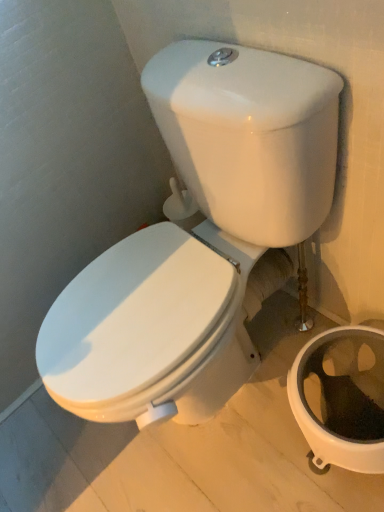
Image resolution: width=384 pixels, height=512 pixels. What do you see at coordinates (200, 239) in the screenshot?
I see `white glossy toilet at center` at bounding box center [200, 239].

Measure the distance between point (220, 223) and camera.

39.17 inches.

Find the location of a particular element. Image resolution: width=384 pixels, height=512 pixels. white glossy toilet at center is located at coordinates tap(200, 239).

The height and width of the screenshot is (512, 384). What are the coordinates of `white glossy toilet at center` in the screenshot? It's located at (200, 239).